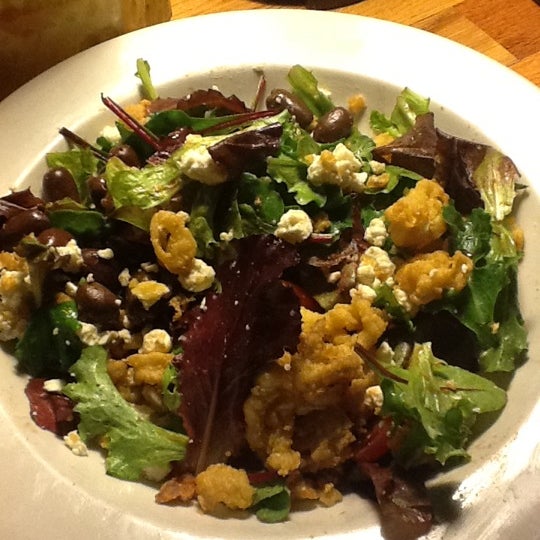
Identify the location of bowl. (368, 48).